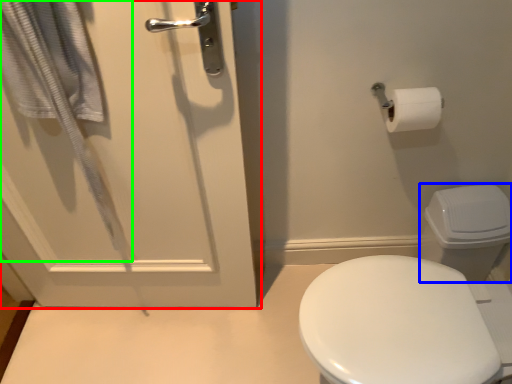
Question: Estimate the real-world distances between objects in this image. Which object is farther from door (highlighted by a red box), toilet bowl (highlighted by a blue box) or bath towel (highlighted by a green box)?

Choices:
 (A) toilet bowl
 (B) bath towel

Answer: (A)